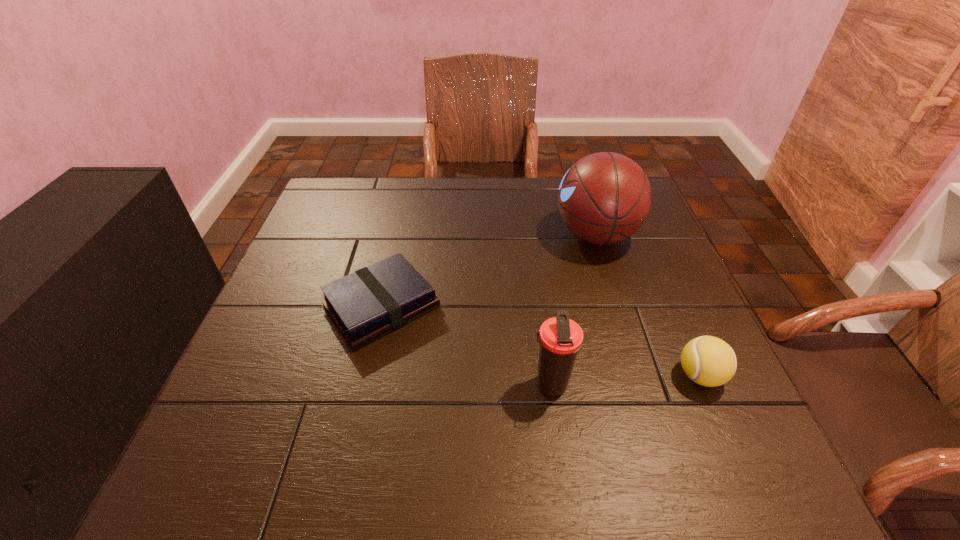
Where is `basketball`? The height and width of the screenshot is (540, 960). basketball is located at coordinates pos(604,198).

Identify the location of the farthest object. (604, 198).

The width and height of the screenshot is (960, 540). Identify the location of the second tallest object. (560, 338).

I want to click on thermos bottle, so [x=560, y=338].

Where is `tennis ball`? The height and width of the screenshot is (540, 960). tennis ball is located at coordinates (709, 361).

The width and height of the screenshot is (960, 540). Find the location of `the third nearest object`. the third nearest object is located at coordinates (365, 305).

Find the location of `book`. book is located at coordinates (365, 305).

Locate an element on the screen. vacant point located on the front of the tallest object is located at coordinates (637, 368).

Find the location of a particular element. free space located 0.320m on the left of the thermos bottle is located at coordinates (358, 386).

This screenshot has width=960, height=540. I want to click on free region located 0.130m on the front of the second shortest object, so click(739, 467).